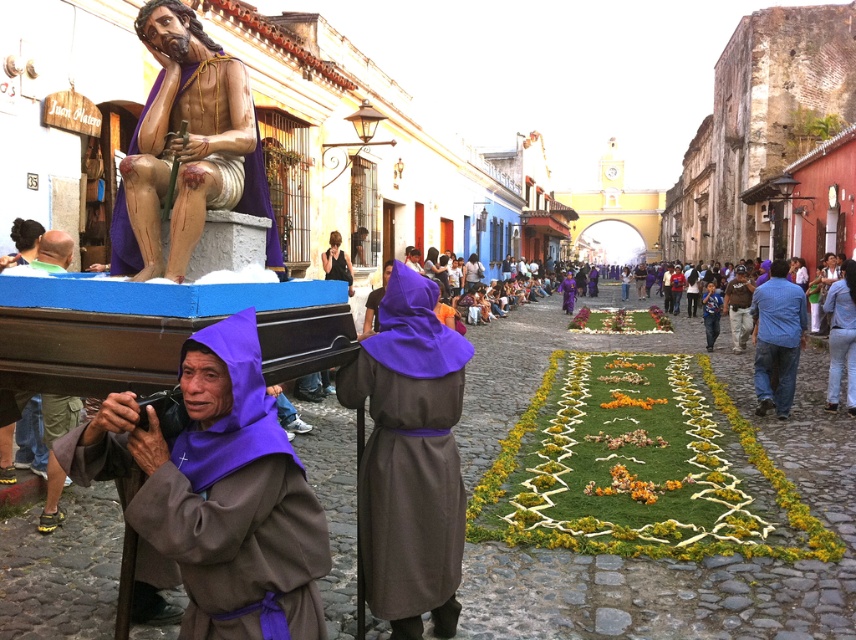
Does point (836, 404) come behind point (566, 298)?

No, it is not.

Based on the photo, does blue jeans at lower right appear on the left side of purple woolen robe at center?

In fact, blue jeans at lower right is to the right of purple woolen robe at center.

The width and height of the screenshot is (856, 640). Identify the location of blue jeans at lower right. (841, 337).

Is brown leather jacket at center further to the viewer compared to purple woolen robe at center?

No, brown leather jacket at center is closer to the viewer.

How far apart are brown leather jacket at center and purple woolen robe at center?

brown leather jacket at center is 121.26 feet from purple woolen robe at center.

At what (x,y) coordinates should I click in order to perform the action: click on brown leather jacket at center. Please return your answer as a coordinate pair (x, y). Looking at the image, I should click on (738, 307).

At what (x,y) coordinates should I click in order to perform the action: click on brown leather jacket at center. Please return your answer as a coordinate pair (x, y). This screenshot has width=856, height=640. Looking at the image, I should click on (738, 307).

Does purple cloth at left have a greater width compared to matte black shirt at center?

In fact, purple cloth at left might be narrower than matte black shirt at center.

Looking at this image, between purple cloth at left and matte black shirt at center, which one has more height?

Standing taller between the two is matte black shirt at center.

Is point (217, 493) positioned in front of point (333, 260)?

Yes, point (217, 493) is in front of point (333, 260).

You are a GUI agent. You are given a task and a screenshot of the screen. Output one action in this format:
    pyautogui.click(x=<x>, y=<y>)
    Task: Click on the purple cloth at left
    The width and height of the screenshot is (856, 640).
    Given the screenshot: What is the action you would take?
    pyautogui.click(x=218, y=492)